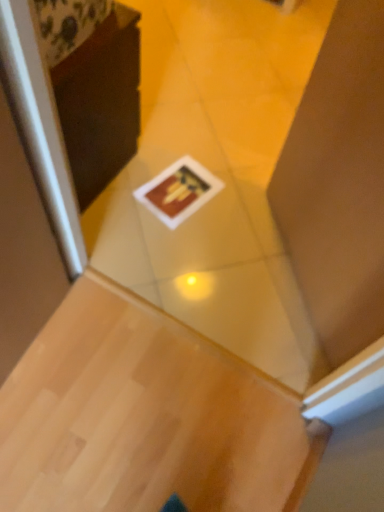
What is the approximate width of wooden drawer at left?

The width of wooden drawer at left is 5.07 inches.

Identify the location of wooden drawer at left. This screenshot has width=384, height=512. (100, 102).

This screenshot has height=512, width=384. What do you see at coordinates (100, 102) in the screenshot?
I see `wooden drawer at left` at bounding box center [100, 102].

This screenshot has width=384, height=512. I want to click on wooden drawer at left, so click(100, 102).